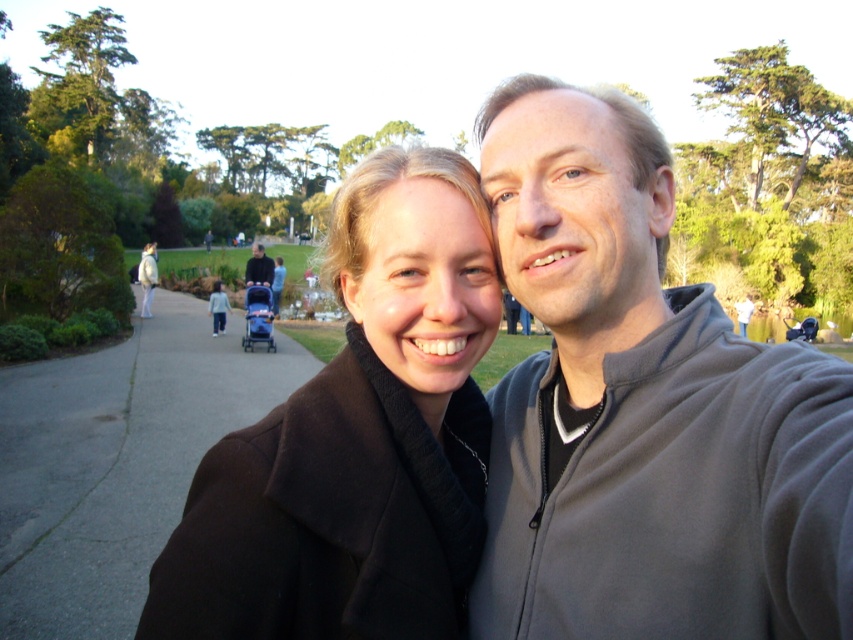
Question: Among these objects, which one is farthest from the camera?

Choices:
 (A) black wool coat at center
 (B) dark gray asphalt at lower left

Answer: (B)

Question: Does gray fleece sweatshirt at upper right appear on the right side of dark gray asphalt at lower left?

Choices:
 (A) yes
 (B) no

Answer: (A)

Question: Which of the following is the closest to the observer?

Choices:
 (A) (39, 588)
 (B) (593, 212)

Answer: (B)

Question: Does black wool coat at center have a greater width compared to gray fleece sweatshirt at upper right?

Choices:
 (A) yes
 (B) no

Answer: (A)

Question: Which of the following is the closest to the observer?

Choices:
 (A) (537, 616)
 (B) (166, 428)
 (C) (726, 442)
 (D) (245, 497)

Answer: (C)

Question: Is gray fleece sweatshirt at upper right smaller than dark blue stroller at center?

Choices:
 (A) no
 (B) yes

Answer: (B)